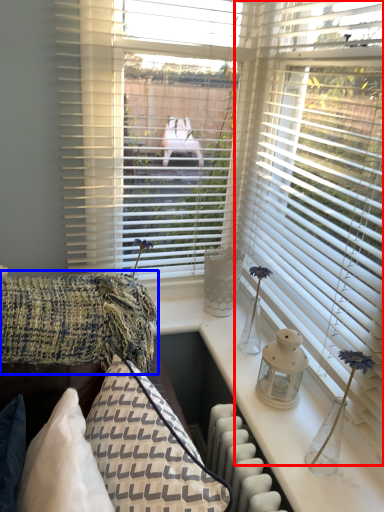
Question: Which object appears farthest to the camera in this image, window blind (highlighted by a red box) or blanket (highlighted by a blue box)?

Choices:
 (A) window blind
 (B) blanket

Answer: (B)